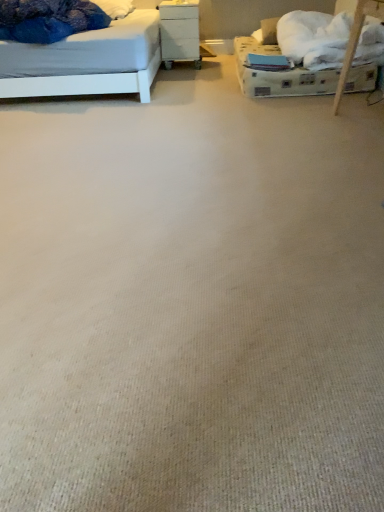
Identify the location of vacant area in front of white glossy nightstand at center. (188, 69).